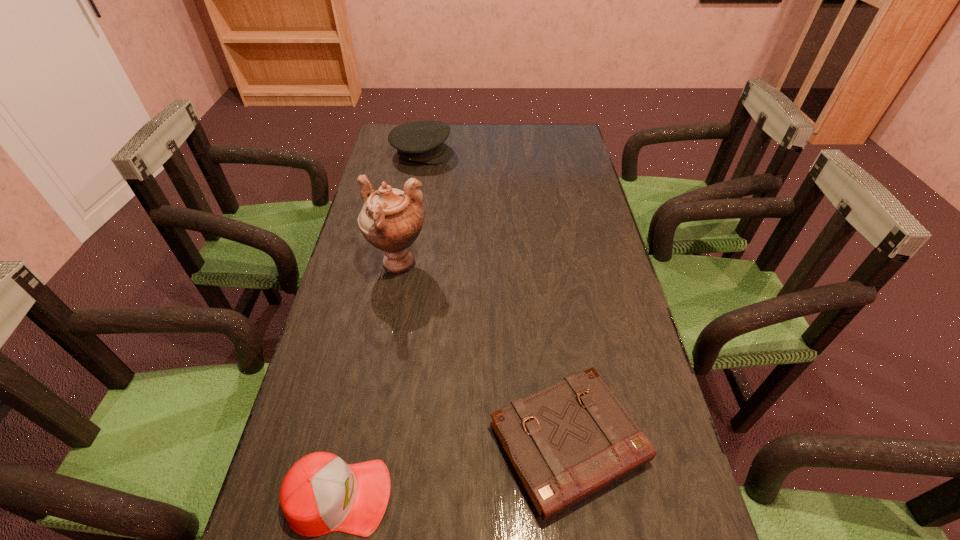
Where is `free spot located on the back of the rightmost object`? The height and width of the screenshot is (540, 960). free spot located on the back of the rightmost object is located at coordinates (552, 329).

The width and height of the screenshot is (960, 540). In order to click on object located in the far edge section of the desktop in this screenshot , I will do `click(422, 141)`.

The image size is (960, 540). I want to click on urn positioned at the left edge, so click(x=391, y=220).

The width and height of the screenshot is (960, 540). What are the coordinates of `beret at the left edge` in the screenshot? It's located at (422, 141).

Locate an element on the screen. This screenshot has width=960, height=540. baseball cap present at the left edge is located at coordinates (320, 494).

I want to click on object at the right edge, so click(566, 442).

Find the location of a particular element. Image resolution: width=960 pixels, height=540 pixels. object that is positioned at the far left corner is located at coordinates (422, 141).

The width and height of the screenshot is (960, 540). In the image, there is a desktop. Identify the location of blank space at the far edge. (502, 143).

Locate an element on the screen. The height and width of the screenshot is (540, 960). vacant space at the left edge of the desktop is located at coordinates (357, 242).

Where is `vacant point at the right edge`? This screenshot has height=540, width=960. vacant point at the right edge is located at coordinates (602, 306).